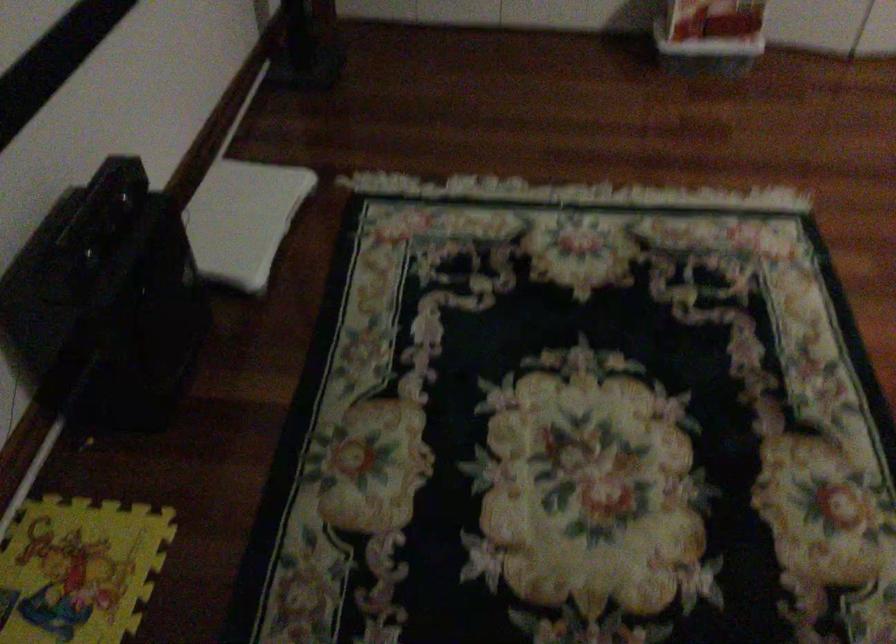
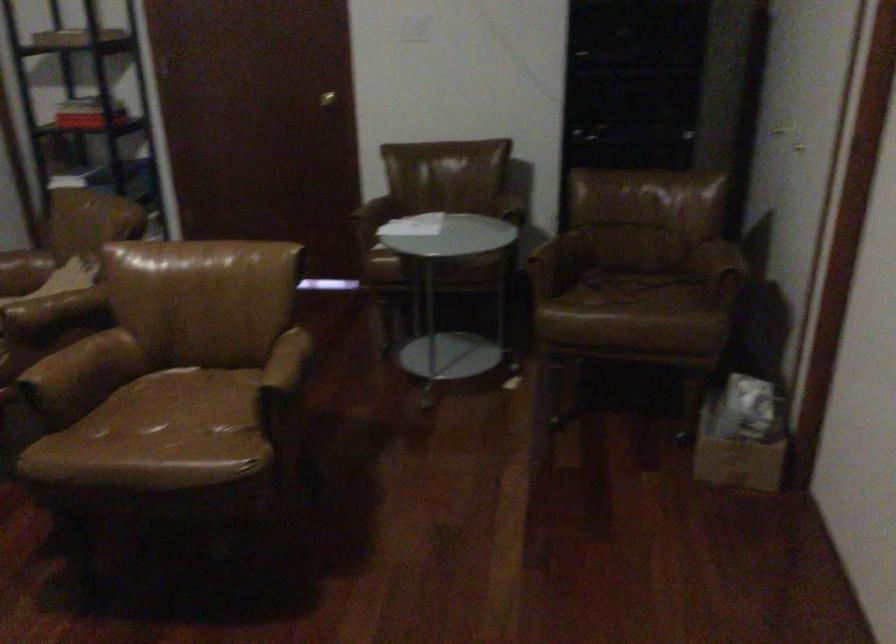
Question: The camera is either moving clockwise (left) or counter-clockwise (right) around the object. The first image is from the beginning of the video and the second image is from the end. Is the camera moving left or right when shooting the video?

Choices:
 (A) Left
 (B) Right

Answer: (A)